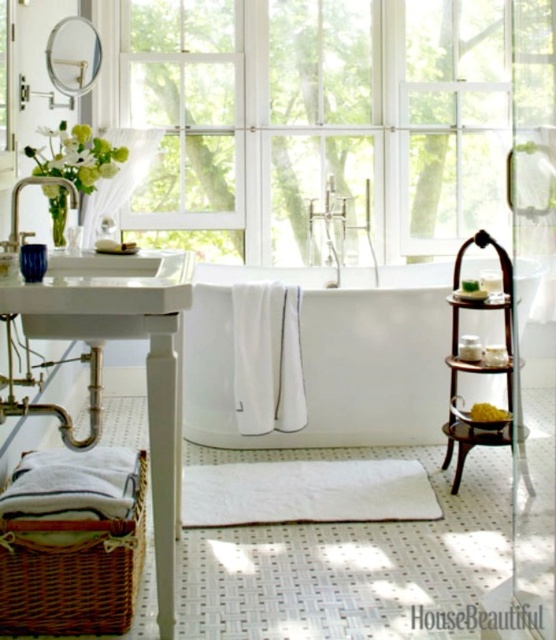
Question: Is white glass window at upper center wider than white wood vanity at left?

Choices:
 (A) no
 (B) yes

Answer: (B)

Question: Which point appears farthest from the camera in this image?

Choices:
 (A) (38, 336)
 (B) (191, 321)

Answer: (B)

Question: In this image, where is white glossy bathtub at center located relative to white wood vanity at left?

Choices:
 (A) above
 (B) below

Answer: (A)

Question: Among these objects, which one is nearest to the camera?

Choices:
 (A) white glass window at upper center
 (B) wooden stool at lower right
 (C) matte silver faucet at left

Answer: (C)

Question: Which point appears closest to the camera in this image?

Choices:
 (A) (13, 198)
 (B) (359, 436)

Answer: (A)

Question: Does wooden stool at lower right have a larger size compared to matte silver faucet at left?

Choices:
 (A) yes
 (B) no

Answer: (B)